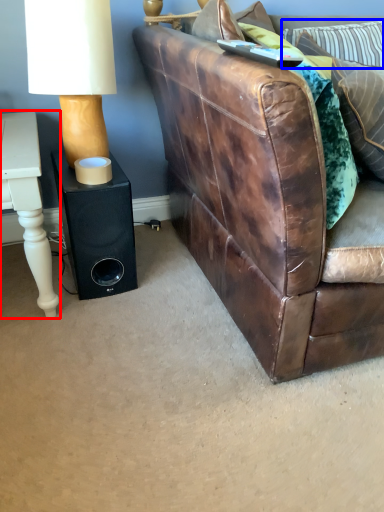
Question: Which of the following is the closest to the observer, table (highlighted by a red box) or pillow (highlighted by a blue box)?

Choices:
 (A) table
 (B) pillow

Answer: (A)